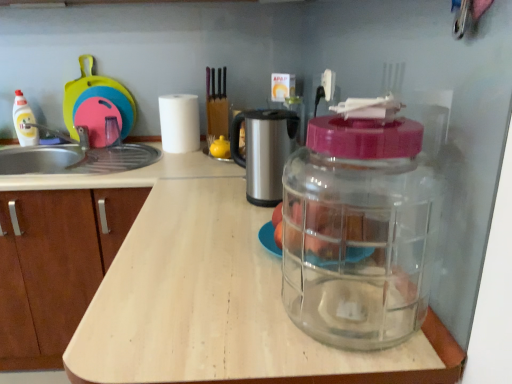
Question: Is the depth of transparent wood countertop at center greater than that of rubberized plastic cutting board at upper left?

Choices:
 (A) no
 (B) yes

Answer: (A)

Question: Is transparent wood countertop at center not near rubberized plastic cutting board at upper left?

Choices:
 (A) yes
 (B) no

Answer: (B)

Question: Is transparent wood countertop at center positioned with its back to rubberized plastic cutting board at upper left?

Choices:
 (A) yes
 (B) no

Answer: (B)

Question: Can you confirm if transparent wood countertop at center is wider than rubberized plastic cutting board at upper left?

Choices:
 (A) no
 (B) yes

Answer: (B)

Question: Is transparent wood countertop at center to the right of rubberized plastic cutting board at upper left from the viewer's perspective?

Choices:
 (A) yes
 (B) no

Answer: (A)

Question: Is point (340, 329) closer or farther from the camera than point (197, 120)?

Choices:
 (A) farther
 (B) closer

Answer: (B)

Question: Looking at the image, does transparent plastic container at center, which is the first bottle from bottom to top, seem bigger or smaller compared to white matte paper towel at center?

Choices:
 (A) big
 (B) small

Answer: (A)

Question: From the image's perspective, is transparent plastic container at center, which is the first bottle from bottom to top, positioned above or below white matte paper towel at center?

Choices:
 (A) below
 (B) above

Answer: (A)

Question: In the image, is transparent plastic container at center, which is the first bottle from bottom to top, on the left side or the right side of white matte paper towel at center?

Choices:
 (A) left
 (B) right

Answer: (B)

Question: Considering the positions of rubberized plastic cutting board at upper left and stainless steel coffee maker at center in the image, is rubberized plastic cutting board at upper left taller or shorter than stainless steel coffee maker at center?

Choices:
 (A) tall
 (B) short

Answer: (A)

Question: Is rubberized plastic cutting board at upper left inside the boundaries of stainless steel coffee maker at center, or outside?

Choices:
 (A) outside
 (B) inside

Answer: (A)

Question: Considering the positions of rubberized plastic cutting board at upper left and stainless steel coffee maker at center in the image, is rubberized plastic cutting board at upper left bigger or smaller than stainless steel coffee maker at center?

Choices:
 (A) small
 (B) big

Answer: (B)

Question: From a real-world perspective, is rubberized plastic cutting board at upper left physically located above or below stainless steel coffee maker at center?

Choices:
 (A) below
 (B) above

Answer: (B)

Question: Is point (165, 148) closer or farther from the camera than point (376, 221)?

Choices:
 (A) closer
 (B) farther

Answer: (B)

Question: In the image, is white matte paper towel at center on the left side or the right side of translucent glass apples at center?

Choices:
 (A) left
 (B) right

Answer: (A)